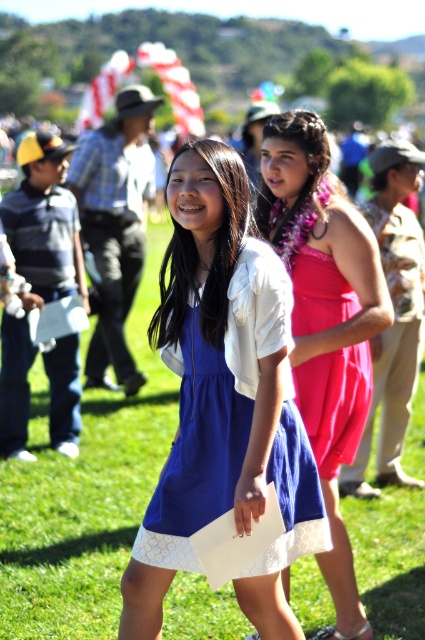
Question: Based on their relative distances, which object is farther from the blue satin dress at center?

Choices:
 (A) shiny pink dress at center
 (B) pink satin dress at center

Answer: (B)

Question: Estimate the real-world distances between objects in this image. Which object is farther from the pink satin dress at center?

Choices:
 (A) blue satin dress at center
 (B) shiny pink dress at center

Answer: (A)

Question: Among these objects, which one is nearest to the camera?

Choices:
 (A) pink satin dress at center
 (B) blue satin dress at center
 (C) shiny pink dress at center

Answer: (B)

Question: Can you confirm if blue satin dress at center is thinner than pink satin dress at center?

Choices:
 (A) yes
 (B) no

Answer: (B)

Question: From the image, what is the correct spatial relationship of shiny pink dress at center in relation to pink satin dress at center?

Choices:
 (A) left
 (B) right

Answer: (A)

Question: Is the position of blue satin dress at center more distant than that of pink satin dress at center?

Choices:
 (A) yes
 (B) no

Answer: (B)